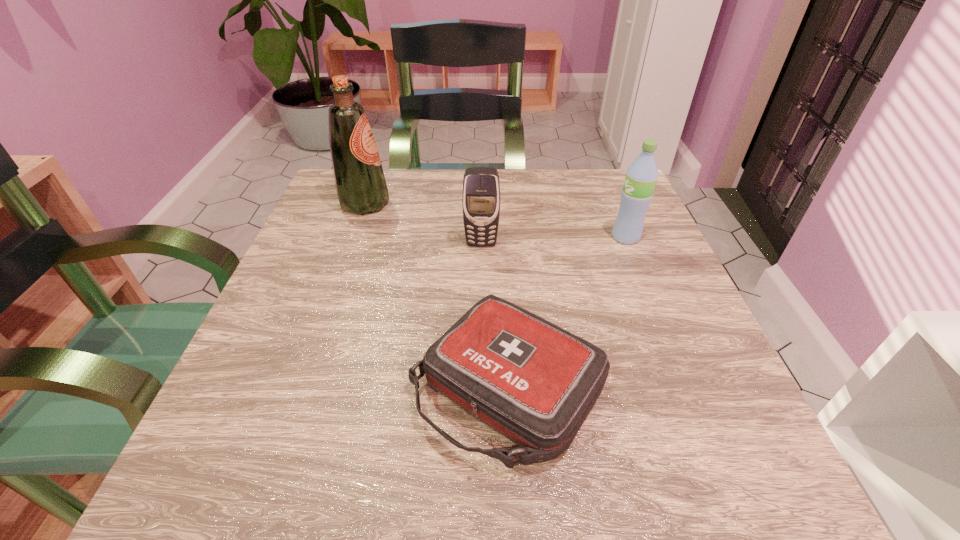
Locate an element on the screen. The height and width of the screenshot is (540, 960). olive oil is located at coordinates (361, 188).

Image resolution: width=960 pixels, height=540 pixels. Identify the location of the tallest object. point(361,188).

At what (x,y) coordinates should I click in order to perform the action: click on the second tallest object. Please return your answer as a coordinate pair (x, y). The height and width of the screenshot is (540, 960). Looking at the image, I should click on (641, 177).

Where is `water bottle`? water bottle is located at coordinates (641, 177).

The image size is (960, 540). I want to click on the third tallest object, so click(x=481, y=188).

This screenshot has height=540, width=960. Find the location of `the shortest object`. the shortest object is located at coordinates (533, 382).

Image resolution: width=960 pixels, height=540 pixels. In order to click on the first-aid kit in this screenshot , I will do `click(533, 382)`.

Where is `free point located 0.390m on the front-facing side of the olive oil`? Image resolution: width=960 pixels, height=540 pixels. free point located 0.390m on the front-facing side of the olive oil is located at coordinates (557, 204).

Find the location of a particular element. vacant area situated on the front of the water bottle is located at coordinates (642, 278).

I want to click on blank area located on the front face of the third tallest object, so click(482, 422).